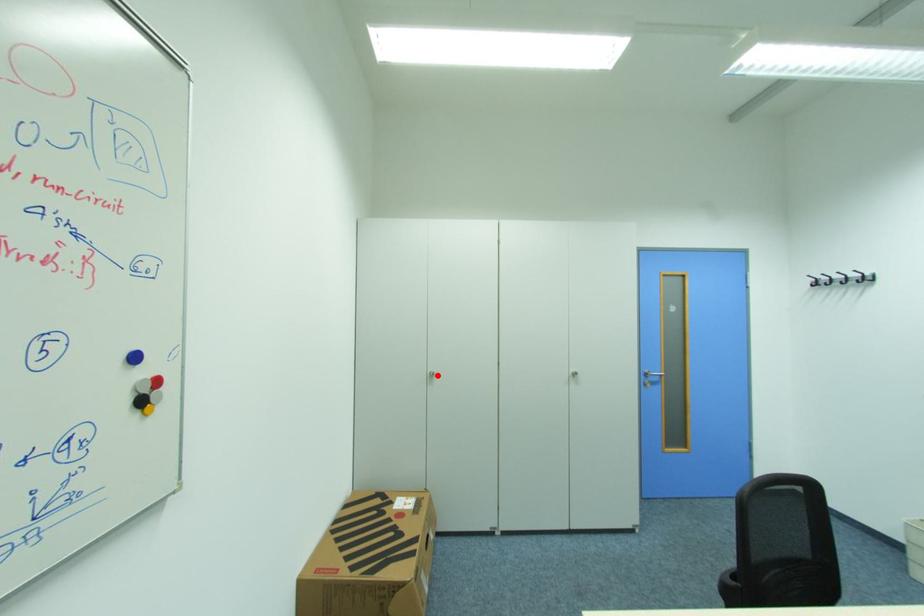
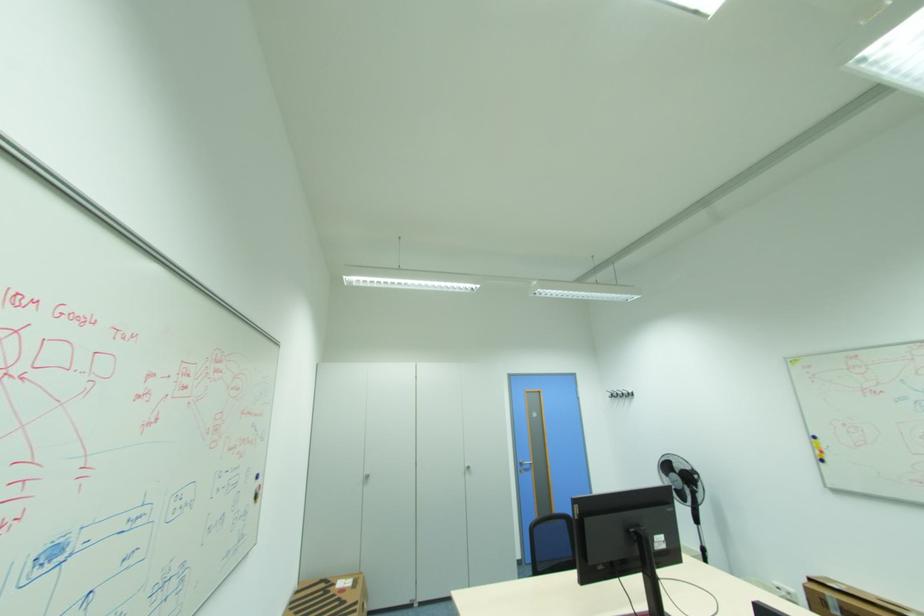
Question: I am providing you with two images of the same scene from different viewpoints. A red point is marked on the first image. Can you still see the location of the red point in image 2?

Choices:
 (A) Yes
 (B) No

Answer: (A)